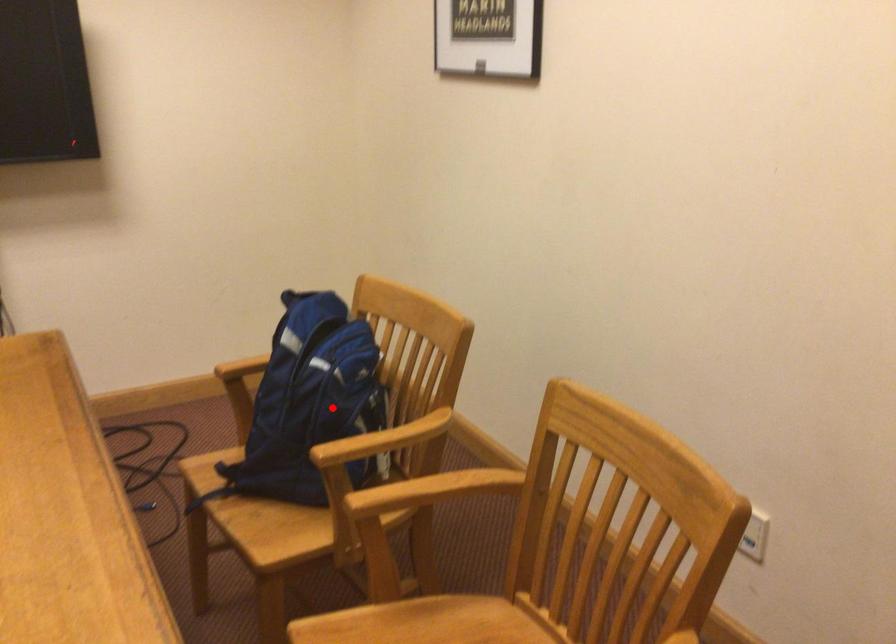
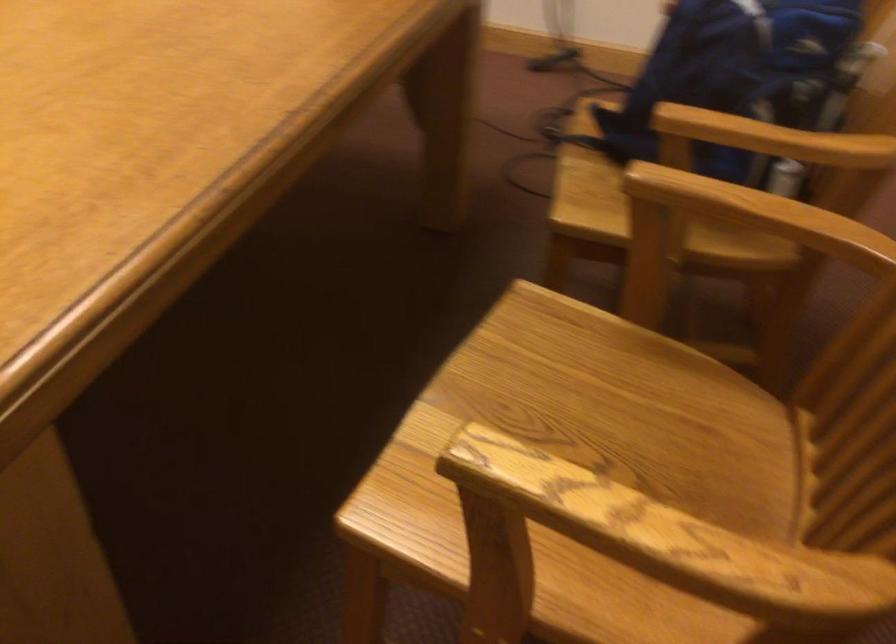
Where in the second image is the point corresponding to the highlighted location from the first image?

(736, 73)